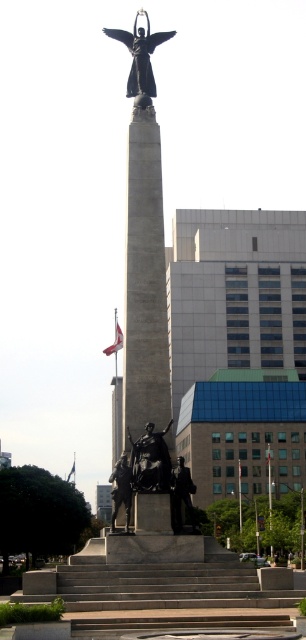
Question: Where is polished bronze statue at upper center located in relation to bronze statue at center in the image?

Choices:
 (A) right
 (B) left

Answer: (A)

Question: Which point is closer to the camera taking this photo?

Choices:
 (A) (112, 476)
 (B) (124, 32)

Answer: (A)

Question: Which object appears farthest from the camera in this image?

Choices:
 (A) polished bronze statue at upper center
 (B) bronze statue at center

Answer: (A)

Question: Considering the relative positions of polished bronze statue at upper center and bronze statue at center in the image provided, where is polished bronze statue at upper center located with respect to bronze statue at center?

Choices:
 (A) above
 (B) below

Answer: (A)

Question: Does polished bronze statue at upper center lie behind bronze statue at center?

Choices:
 (A) yes
 (B) no

Answer: (A)